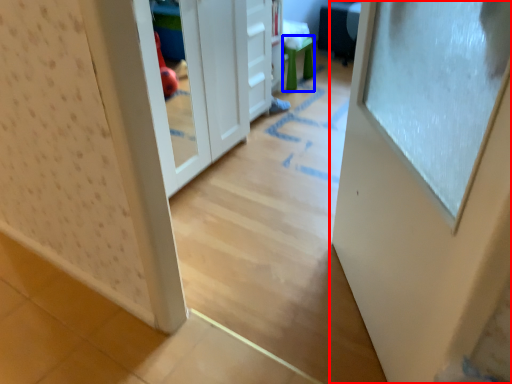
Question: Which object is further to the camera taking this photo, door (highlighted by a red box) or stool (highlighted by a blue box)?

Choices:
 (A) door
 (B) stool

Answer: (B)